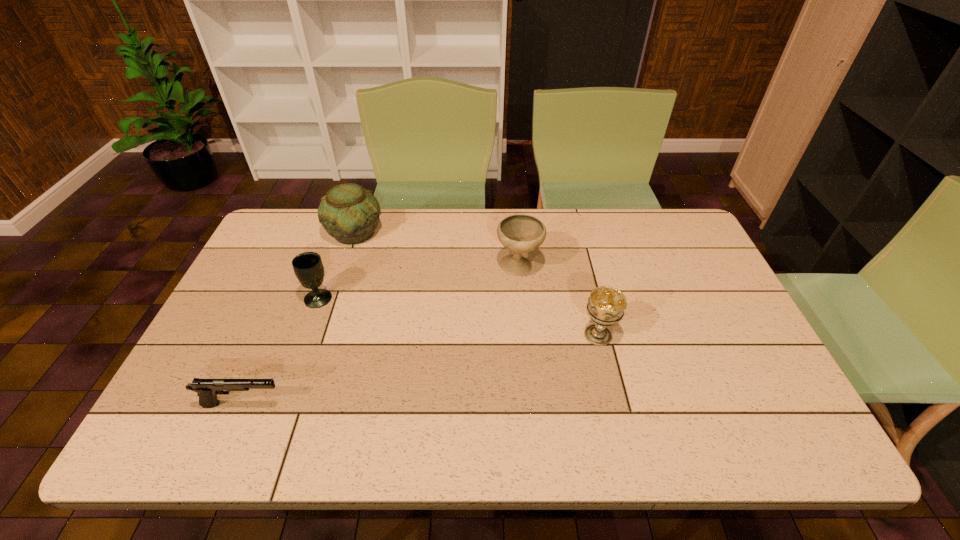
Where is `vacant space at the near right corner of the desktop`? vacant space at the near right corner of the desktop is located at coordinates (771, 429).

The image size is (960, 540). In order to click on empty space between the farthest object and the nearest chalice in this screenshot , I will do `click(476, 284)`.

Find the location of a particular element. This screenshot has height=540, width=960. free space between the second chalice from right to left and the pottery is located at coordinates (437, 249).

Locate an element on the screen. free space between the nearest object and the second object from right to left is located at coordinates (381, 336).

Where is `free area in between the shortest object and the pottery`? free area in between the shortest object and the pottery is located at coordinates (299, 319).

I want to click on unoccupied position between the shortest object and the fourth object from left to right, so click(381, 336).

Identify the location of free space between the farthest object and the rightmost object. (476, 284).

You are a GUI agent. You are given a task and a screenshot of the screen. Output one action in this format:
    pyautogui.click(x=<x>, y=<y>)
    Task: Click on the free space between the third nearest object and the fourth farthest object
    The image size is (960, 540).
    Given the screenshot: What is the action you would take?
    pyautogui.click(x=458, y=316)

The height and width of the screenshot is (540, 960). Identify the location of free space between the gun and the fourth nearest object. (381, 336).

The width and height of the screenshot is (960, 540). I want to click on vacant point located between the leftmost chalice and the pottery, so click(x=336, y=265).